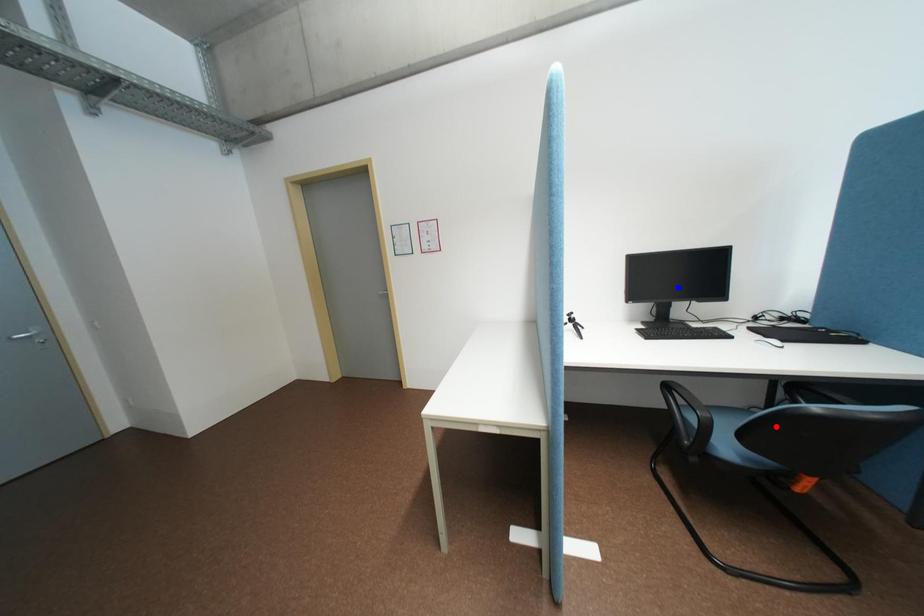
Question: In the image, two points are highlighted. Which point is nearer to the camera? Reply with the corresponding letter.

Choices:
 (A) blue point
 (B) red point

Answer: (B)